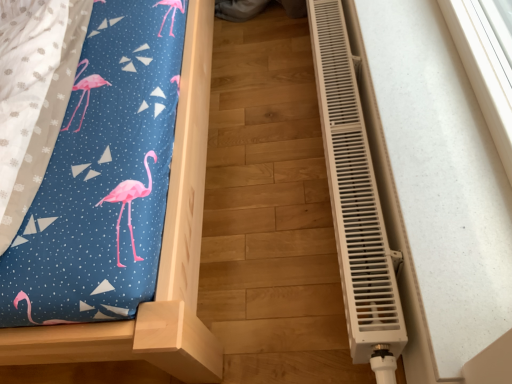
Measure the distance between point (354, 171) and camera.

A distance of 1.03 meters exists between point (354, 171) and camera.

This screenshot has height=384, width=512. Find the location of `white plastic radiator at right`. white plastic radiator at right is located at coordinates (355, 201).

The height and width of the screenshot is (384, 512). What do you see at coordinates (355, 201) in the screenshot?
I see `white plastic radiator at right` at bounding box center [355, 201].

I want to click on wooden bed frame at left, so click(160, 258).

What do you see at coordinates (160, 258) in the screenshot? This screenshot has width=512, height=384. I see `wooden bed frame at left` at bounding box center [160, 258].

I want to click on white plastic radiator at right, so click(x=355, y=201).

Considering the positions of objects wooden bed frame at left and white plastic radiator at right in the image provided, who is more to the left, wooden bed frame at left or white plastic radiator at right?

wooden bed frame at left.

Looking at this image, does wooden bed frame at left lie in front of white plastic radiator at right?

Yes, wooden bed frame at left is in front of white plastic radiator at right.

Considering the positions of points (203, 82) and (394, 321), is point (203, 82) closer to camera compared to point (394, 321)?

That is False.

From the image's perspective, is wooden bed frame at left beneath white plastic radiator at right?

No.

From a real-world perspective, which is physically above, wooden bed frame at left or white plastic radiator at right?

wooden bed frame at left.

Based on the photo, is wooden bed frame at left wider or thinner than white plastic radiator at right?

In the image, wooden bed frame at left appears to be wider than white plastic radiator at right.

Can you confirm if wooden bed frame at left is taller than white plastic radiator at right?

Correct, wooden bed frame at left is much taller as white plastic radiator at right.

Considering the sizes of objects wooden bed frame at left and white plastic radiator at right in the image provided, who is bigger, wooden bed frame at left or white plastic radiator at right?

wooden bed frame at left is bigger.

Is wooden bed frame at left not within white plastic radiator at right?

Absolutely, wooden bed frame at left is external to white plastic radiator at right.

Would you say wooden bed frame at left is a long distance from white plastic radiator at right?

Actually, wooden bed frame at left and white plastic radiator at right are a little close together.

Is wooden bed frame at left facing away from white plastic radiator at right?

No, white plastic radiator at right is not at the back of wooden bed frame at left.

I want to click on air conditioning located on the right of wooden bed frame at left, so pos(355,201).

In the image, is white plastic radiator at right on the left side or the right side of wooden bed frame at left?

From the image, it's evident that white plastic radiator at right is to the right of wooden bed frame at left.

Considering their positions, is white plastic radiator at right located in front of or behind wooden bed frame at left?

Clearly, white plastic radiator at right is behind wooden bed frame at left.

Considering the positions of points (381, 347) and (42, 356), is point (381, 347) closer to camera compared to point (42, 356)?

Yes, point (381, 347) is closer to viewer.

From the image's perspective, is white plastic radiator at right located above wooden bed frame at left?

No.

From a real-world perspective, between white plastic radiator at right and wooden bed frame at left, who is vertically lower?

white plastic radiator at right, from a real-world perspective.

Looking at their sizes, would you say white plastic radiator at right is wider or thinner than wooden bed frame at left?

white plastic radiator at right is thinner than wooden bed frame at left.

Considering the sizes of objects white plastic radiator at right and wooden bed frame at left in the image provided, who is shorter, white plastic radiator at right or wooden bed frame at left?

white plastic radiator at right is shorter.

Can you confirm if white plastic radiator at right is bigger than wooden bed frame at left?

Actually, white plastic radiator at right might be smaller than wooden bed frame at left.

Do you think white plastic radiator at right is within wooden bed frame at left, or outside of it?

white plastic radiator at right is not inside wooden bed frame at left, it's outside.

Is white plastic radiator at right beside wooden bed frame at left?

white plastic radiator at right and wooden bed frame at left are clearly separated.

Is white plastic radiator at right aimed at wooden bed frame at left?

Yes, white plastic radiator at right is aimed at wooden bed frame at left.

How different are the orientations of white plastic radiator at right and wooden bed frame at left in degrees?

The angle between the facing direction of white plastic radiator at right and the facing direction of wooden bed frame at left is 90.5 degrees.

You are a GUI agent. You are given a task and a screenshot of the screen. Output one action in this format:
    pyautogui.click(x=<x>, y=<y>)
    Task: Click on the air conditioning behind the wooden bed frame at left
    The image size is (512, 384).
    Given the screenshot: What is the action you would take?
    tap(355, 201)

Locate an element on the screen. air conditioning that is under the wooden bed frame at left (from a real-world perspective) is located at coordinates (355, 201).

Locate an element on the screen. This screenshot has width=512, height=384. furniture that is above the white plastic radiator at right (from the image's perspective) is located at coordinates (160, 258).